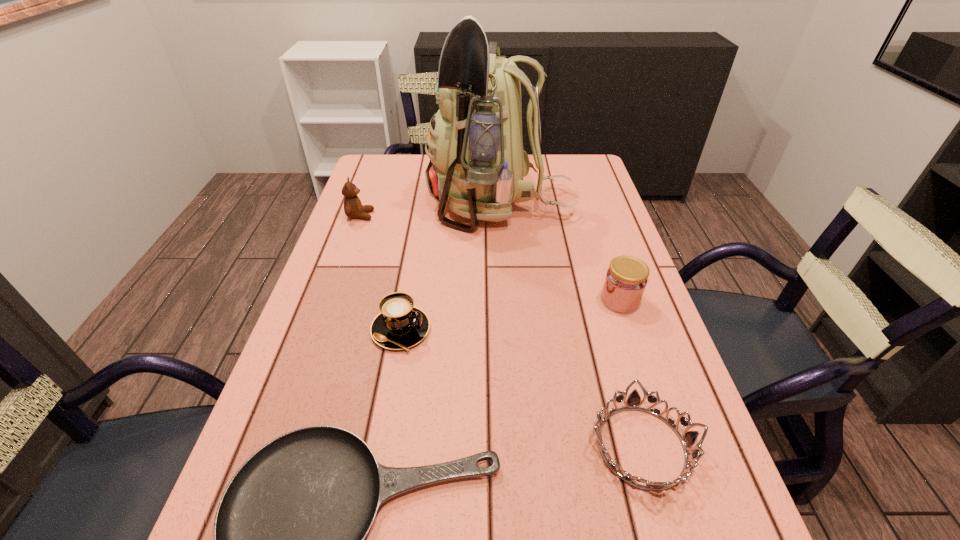
Identify the location of free space located on the right of the cappuccino. (596, 330).

Where is `object located at the far edge`? object located at the far edge is located at coordinates (477, 163).

This screenshot has width=960, height=540. What are the coordinates of `teddy bear that is at the left edge` in the screenshot? It's located at (353, 208).

Find the location of a particular element. The image size is (960, 540). cappuccino positioned at the left edge is located at coordinates (400, 325).

Identify the location of backpack that is at the right edge. The image size is (960, 540). (477, 163).

The height and width of the screenshot is (540, 960). What are the coordinates of `jam located in the right edge section of the desktop` in the screenshot? It's located at (626, 279).

In order to click on tiara that is at the right edge in this screenshot , I will do `click(688, 439)`.

Locate an element on the screen. The width and height of the screenshot is (960, 540). object that is at the far right corner is located at coordinates (477, 163).

The image size is (960, 540). What are the coordinates of `free space at the left edge` in the screenshot? It's located at (348, 382).

The width and height of the screenshot is (960, 540). In the image, there is a desktop. What are the coordinates of `vacant space at the right edge` in the screenshot? It's located at (585, 316).